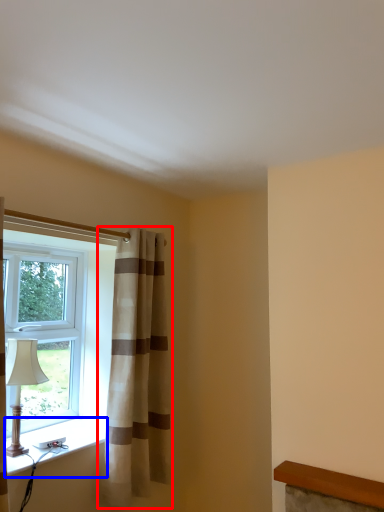
Question: Which object is closer to the camera taking this photo, curtain (highlighted by a red box) or window sill (highlighted by a blue box)?

Choices:
 (A) curtain
 (B) window sill

Answer: (B)